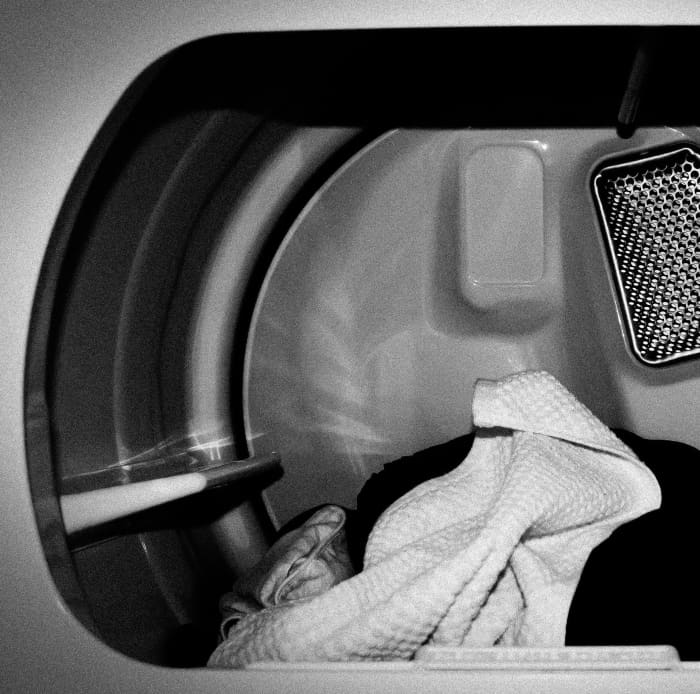
Locate an element on the screen. bottom of dryer area is located at coordinates (204, 647).